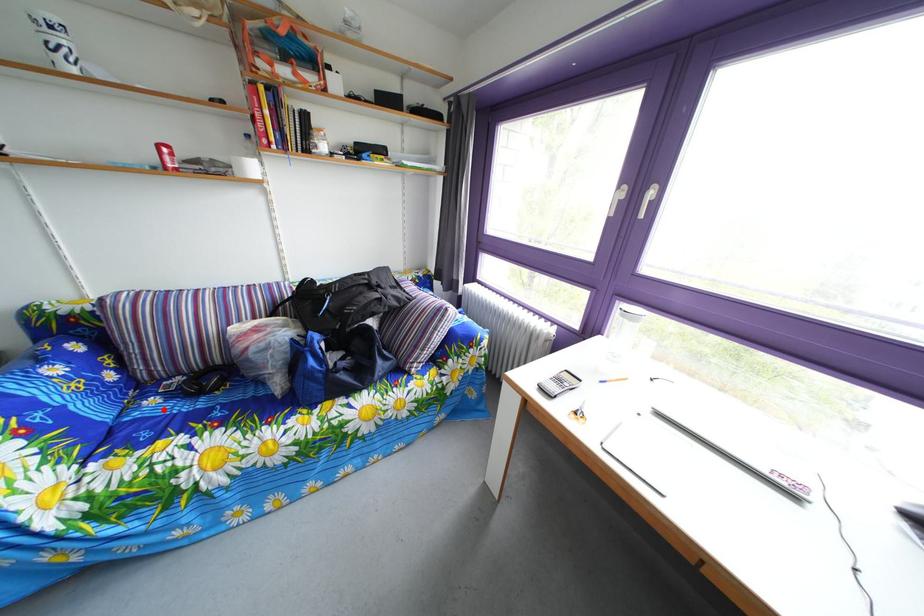
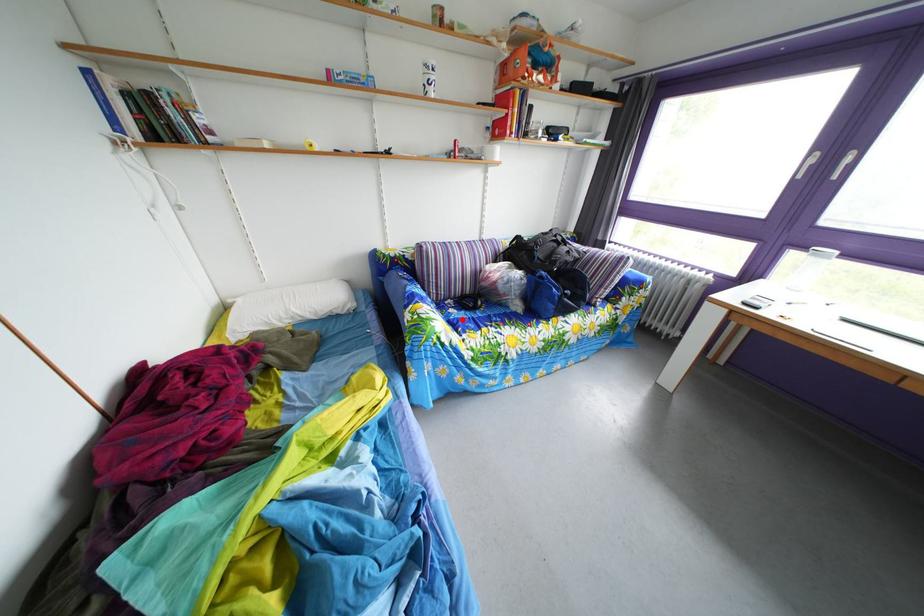
I am providing you with two images of the same scene from different viewpoints. A red point is marked on the first image and another point is marked on the second image. Does the point marked in image1 correspond to the same location as the one in image2?

Yes